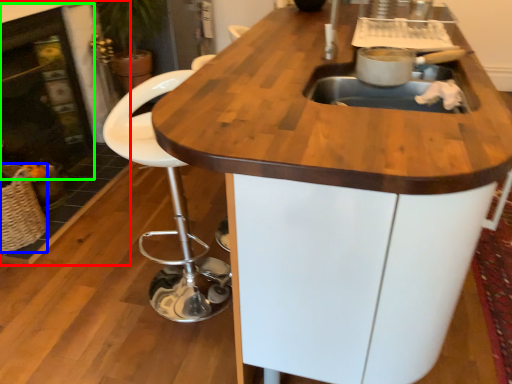
Question: Which object is positioned closest to fireplace (highlighted by a red box)? Select from basket (highlighted by a blue box) and fireplace (highlighted by a green box).

Choices:
 (A) basket
 (B) fireplace

Answer: (B)